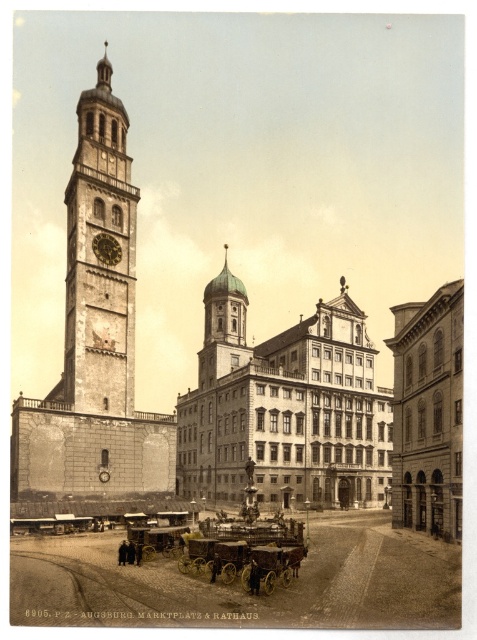
Question: Estimate the real-world distances between objects in this image. Which object is farther from the brass clock at center-left?

Choices:
 (A) stone clock tower at left
 (B) smooth stone church at center
 (C) wooden polished coach at center
 (D) smooth stone tower at left

Answer: (B)

Question: Is stone clock tower at left above brass clock at center-left?

Choices:
 (A) no
 (B) yes

Answer: (B)

Question: Estimate the real-world distances between objects in this image. Which object is closer to the wooden polished coach at center?

Choices:
 (A) smooth stone church at right
 (B) smooth stone church at center
 (C) brass clock at center-left

Answer: (C)

Question: Does smooth stone church at right appear over wooden polished coach at center?

Choices:
 (A) no
 (B) yes

Answer: (B)

Question: Based on their relative distances, which object is nearer to the smooth stone tower at left?

Choices:
 (A) smooth stone church at center
 (B) wooden polished coach at center
 (C) smooth stone church at right
 (D) brass clock at center-left

Answer: (D)

Question: Can you confirm if brass clock at center-left is positioned to the left of wooden polished coach at center?

Choices:
 (A) yes
 (B) no

Answer: (A)